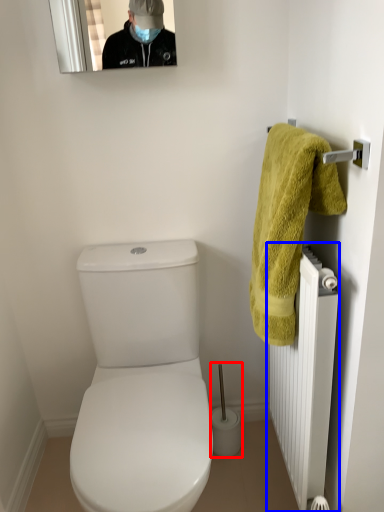
Question: Which of the following is the farthest to the observer, brush (highlighted by a red box) or radiator (highlighted by a blue box)?

Choices:
 (A) brush
 (B) radiator

Answer: (A)